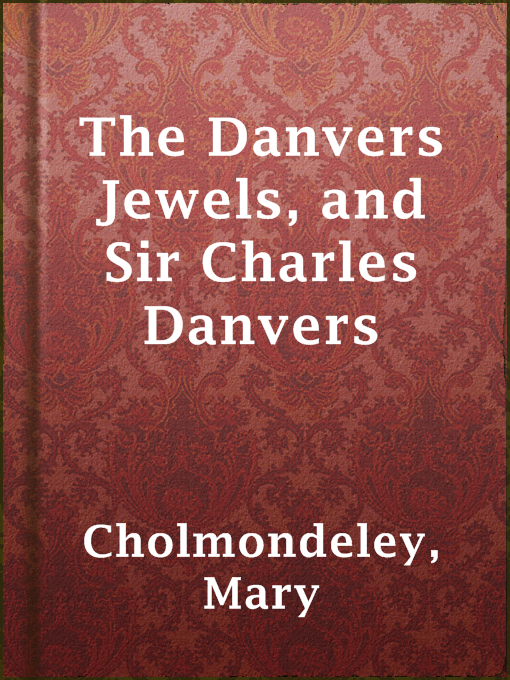
What are the coordinates of `embossed pattern` in the screenshot? It's located at (313, 81), (347, 94).